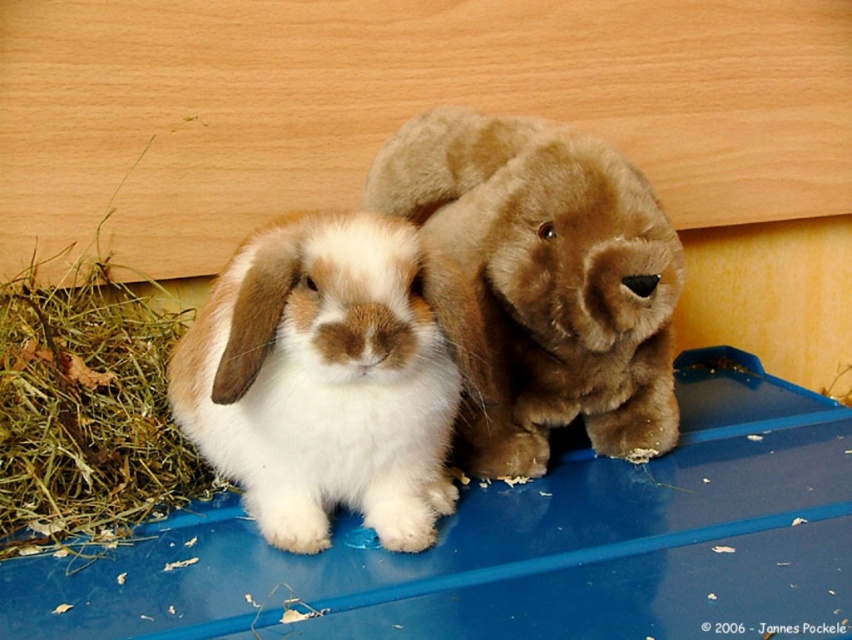
You are a small toy mouse hiding under the blue plastic tray. You want to move from the white soft fur rabbit at center to the brown plush toy at center without being seen. Which direction should you move in?

The white soft fur rabbit at center is closer to the viewer than the brown plush toy at center, so you should move away from the viewer towards the brown plush toy at center to avoid being seen.

You are a child who wants to place a small sticker on the highest point between the white soft fur rabbit at center and the brown plush toy at center. Which object should you choose to place the sticker on?

The brown plush toy at center is higher than the white soft fur rabbit at center, so you should place the sticker on the brown plush toy at center.

You are a caretaker trying to locate two specific points on the blue plastic tray where the rabbits are sitting. The first point is at coordinates point [199,330] and the second is at point [384,182]. From your perspective standing in front of the tray, which point is closer to you?

Point [199,330] is in front of point [384,182], so from your perspective standing in front of the tray, point [199,330] is closer to you.